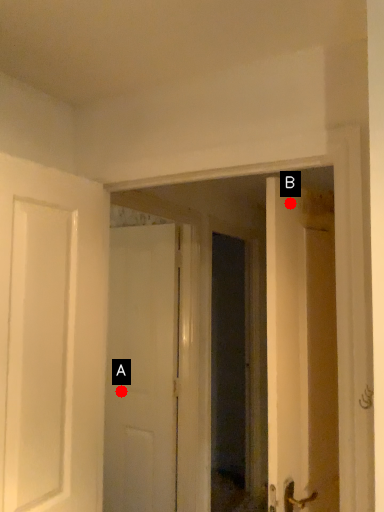
Question: Two points are circled on the image, labeled by A and B beside each circle. Among these points, which one is nearest to the camera?

Choices:
 (A) A is closer
 (B) B is closer

Answer: (B)